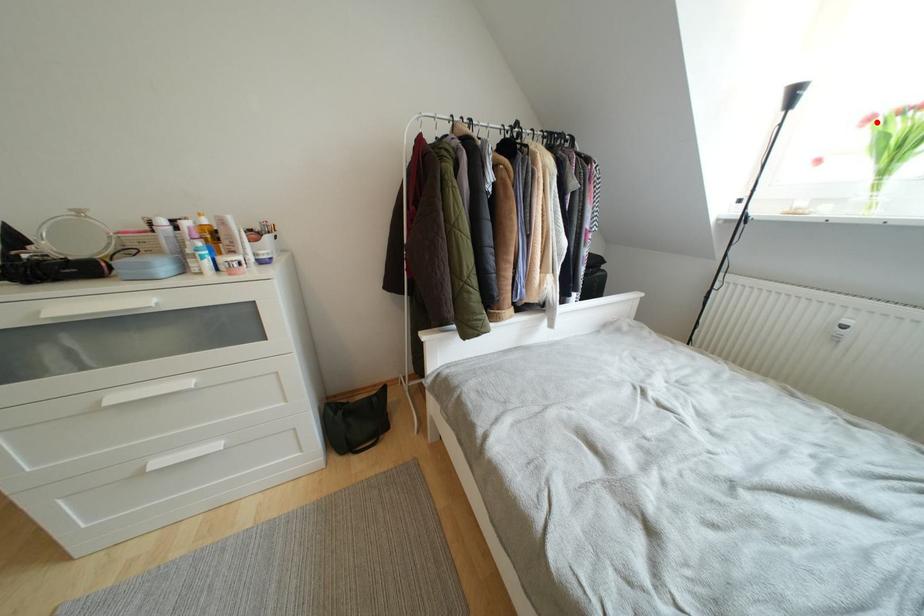
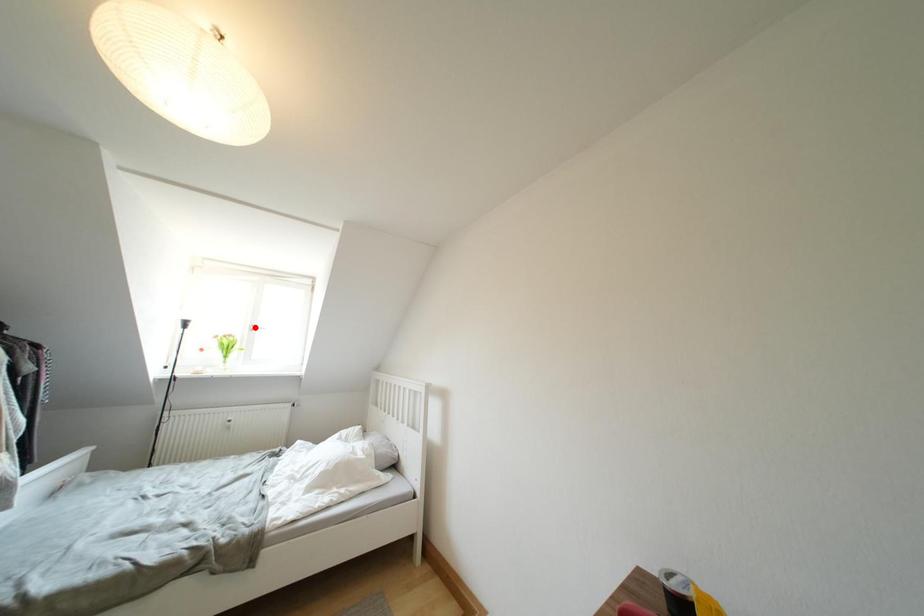
Based on the photo, I am providing you with two images of the same scene from different viewpoints. A red point is marked on the first image and another point is marked on the second image. Is the marked point in image1 the same physical position as the marked point in image2?

No